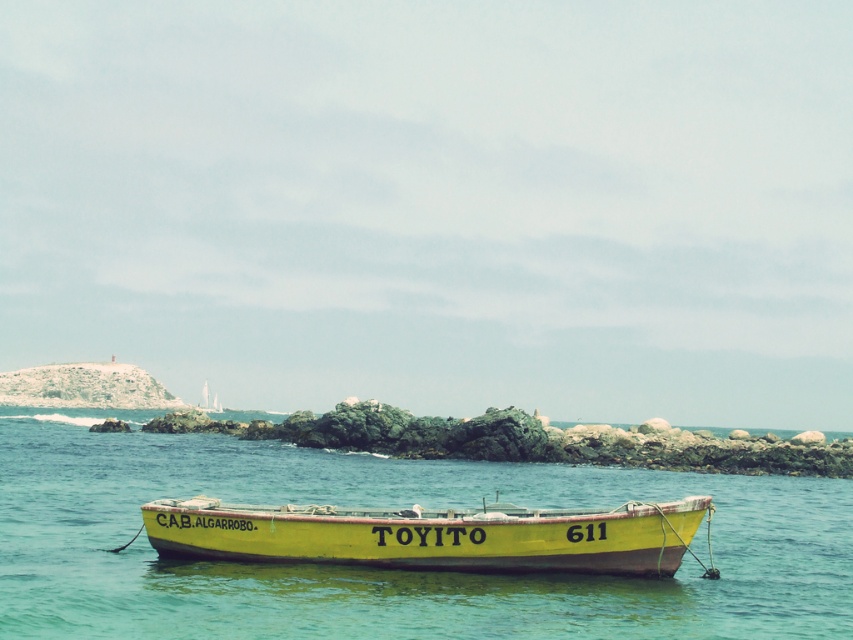
Who is more forward, (590,481) or (567,561)?

Positioned in front is point (567,561).

At what (x,y) coordinates should I click in order to perform the action: click on turquoise water at center. Please return your answer as a coordinate pair (x, y). The image size is (853, 640). Looking at the image, I should click on (383, 568).